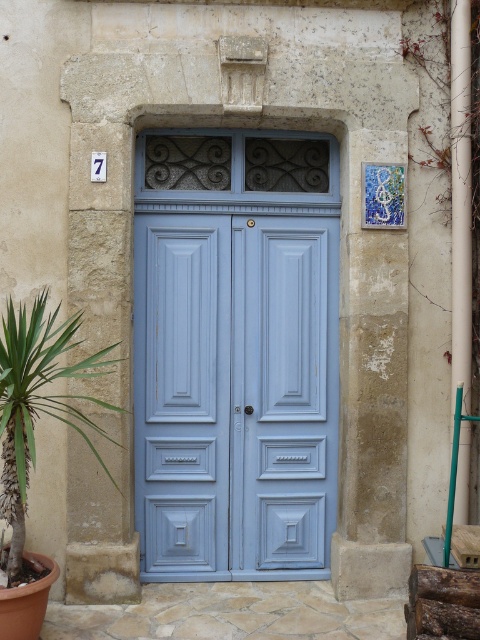
Question: Can you confirm if light blue wood door at center is bigger than green leafy plant at lower left?

Choices:
 (A) no
 (B) yes

Answer: (A)

Question: In this image, where is light blue wood door at center located relative to green leafy plant at lower left?

Choices:
 (A) left
 (B) right

Answer: (B)

Question: Is light blue wood door at center thinner than green leafy plant at lower left?

Choices:
 (A) yes
 (B) no

Answer: (B)